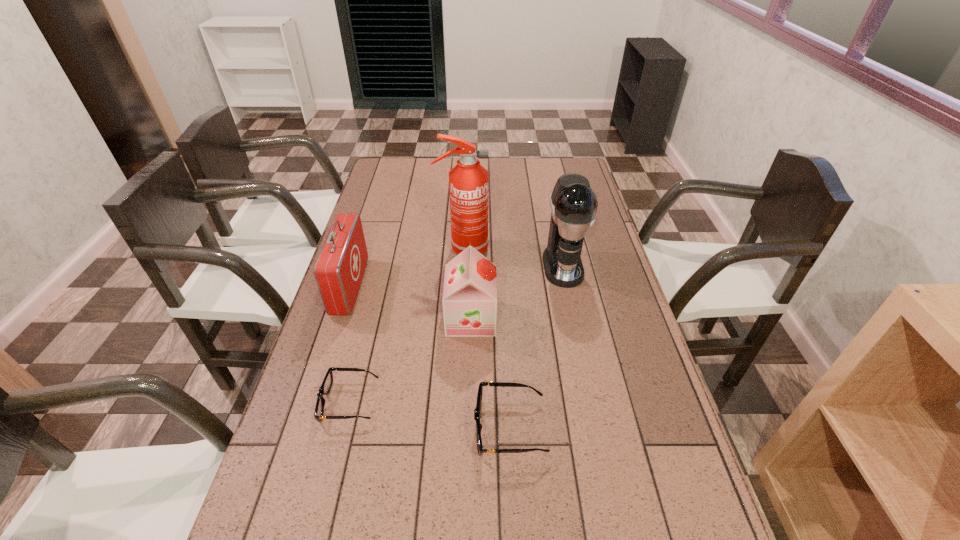
This screenshot has height=540, width=960. Find the location of `the shorter sunglasses`. the shorter sunglasses is located at coordinates (325, 388).

The image size is (960, 540). Find the location of `the left sunglasses`. the left sunglasses is located at coordinates (325, 388).

Locate an element on the screen. Image resolution: width=960 pixels, height=540 pixels. the second shortest object is located at coordinates (477, 410).

The height and width of the screenshot is (540, 960). I want to click on the right sunglasses, so click(477, 410).

Image resolution: width=960 pixels, height=540 pixels. Find the location of `soya milk`. soya milk is located at coordinates (469, 300).

At what (x,y) coordinates should I click in order to perform the action: click on the rightmost object. Please return your answer as a coordinate pair (x, y). Looking at the image, I should click on (573, 203).

Image resolution: width=960 pixels, height=540 pixels. I want to click on coffee maker, so click(x=573, y=203).

Locate an element on the screen. the first-aid kit is located at coordinates (339, 269).

This screenshot has width=960, height=540. I want to click on fire extinguisher, so click(468, 181).

Where is `blank space located on the front-facing side of the shorter sunglasses`? This screenshot has height=540, width=960. blank space located on the front-facing side of the shorter sunglasses is located at coordinates (298, 402).